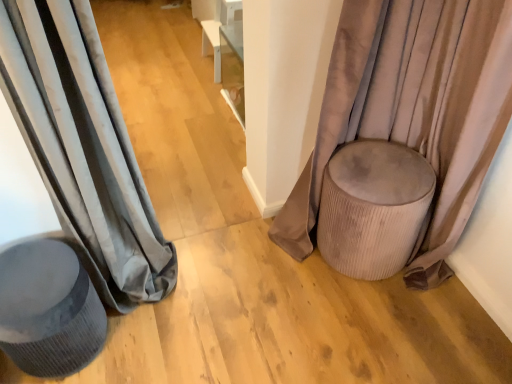
Locate an element on the screen. empty space that is ontop of matte gray stool at left (from a real-world perspective) is located at coordinates (28, 272).